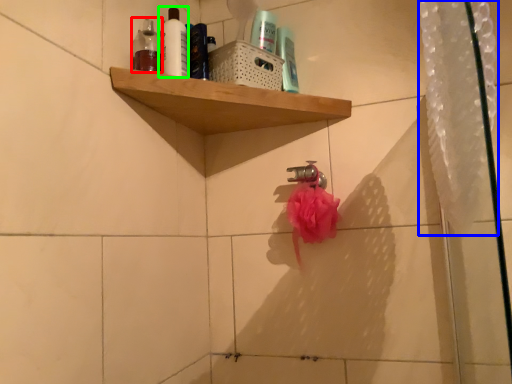
Question: Based on their relative distances, which object is farther from toiletry (highlighted by a red box)? Choose from shower curtain (highlighted by a blue box) and mouthwash (highlighted by a green box).

Choices:
 (A) shower curtain
 (B) mouthwash

Answer: (A)